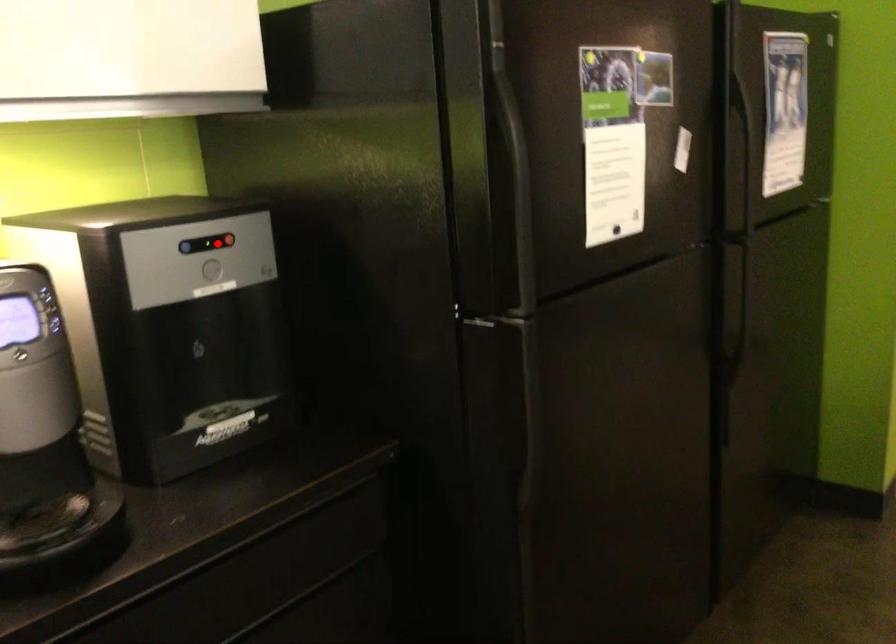
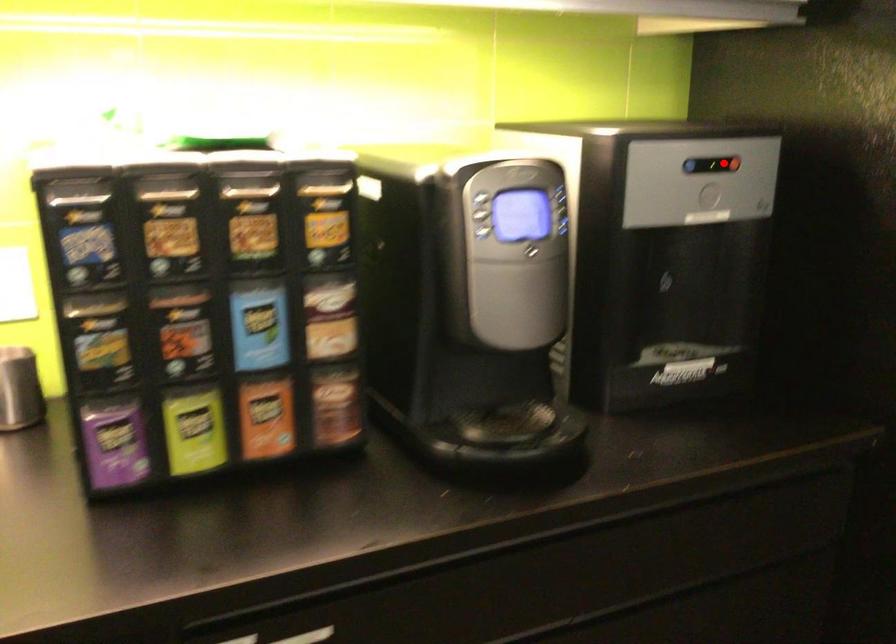
I am providing you with two images of the same scene from different viewpoints. A red point is marked on the first image and another point is marked on the second image. Is the marked point in image1 the same physical position as the marked point in image2?

Yes